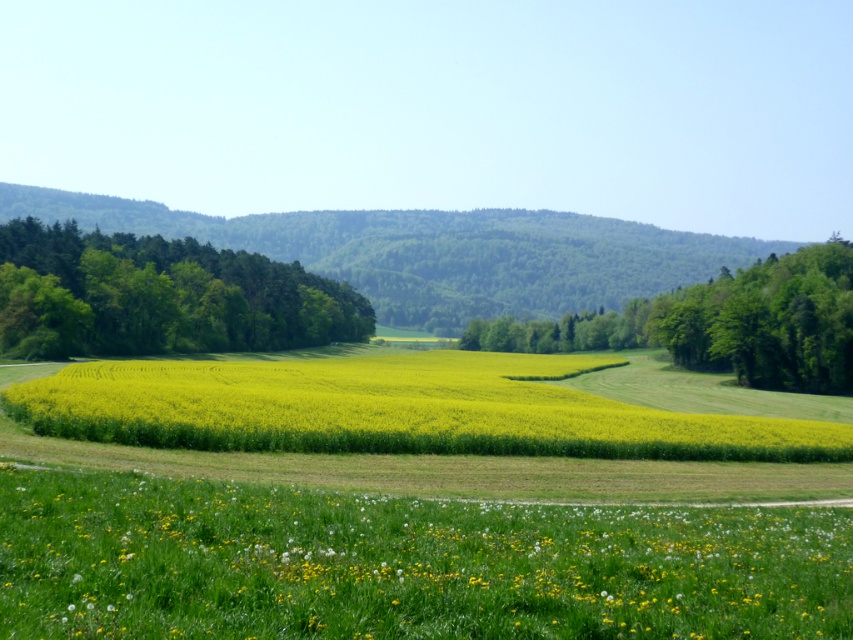
Is green leafy trees at left above green leafy trees at center?

Indeed, green leafy trees at left is positioned over green leafy trees at center.

Does green leafy trees at left appear on the left side of green leafy trees at center?

Yes, green leafy trees at left is to the left of green leafy trees at center.

Locate an element on the screen. green leafy trees at left is located at coordinates (160, 296).

From the picture: Can you confirm if yellow matte field at center is wider than green leafy trees at left?

Indeed, yellow matte field at center has a greater width compared to green leafy trees at left.

Is yellow matte field at center below green leafy trees at left?

Yes, yellow matte field at center is below green leafy trees at left.

Locate an element on the screen. This screenshot has height=640, width=853. yellow matte field at center is located at coordinates (395, 410).

At what (x,y) coordinates should I click in order to perform the action: click on yellow matte field at center. Please return your answer as a coordinate pair (x, y). Looking at the image, I should click on (395, 410).

Who is lower down, yellow soft grass at lower center or green leafy trees at left?

yellow soft grass at lower center

Identify the location of yellow soft grass at lower center. The width and height of the screenshot is (853, 640). (403, 564).